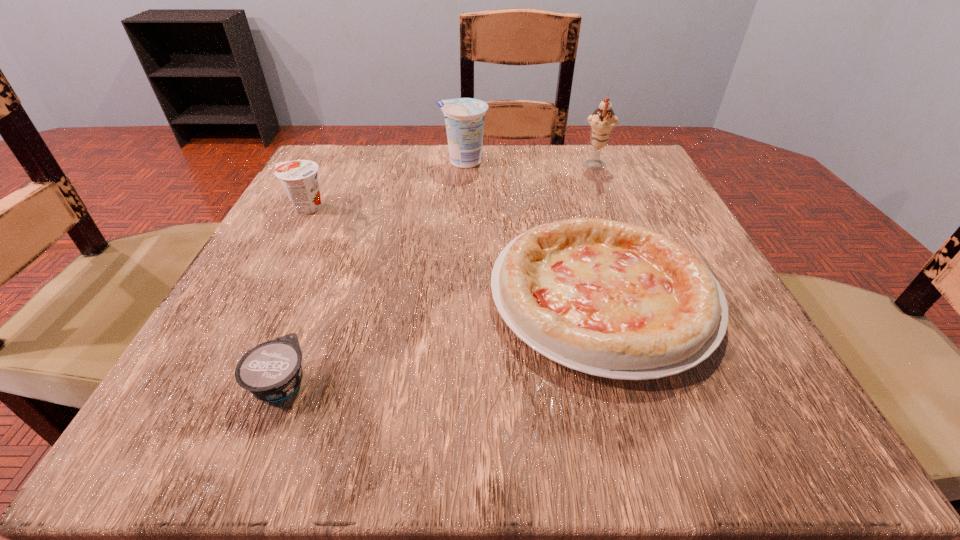
Where is `icecream`? The width and height of the screenshot is (960, 540). icecream is located at coordinates (602, 122).

This screenshot has height=540, width=960. I want to click on the tallest yogurt, so click(x=464, y=117).

You are a GUI agent. You are given a task and a screenshot of the screen. Output one action in this format:
    pyautogui.click(x=<x>, y=<y>)
    Task: Click on the second tallest object
    
    Given the screenshot: What is the action you would take?
    pyautogui.click(x=464, y=117)

Identify the location of the leftmost yogurt. (299, 178).

Locate an element on the screen. This screenshot has height=540, width=960. the third shortest object is located at coordinates (299, 178).

Identify the location of the second shortest object. The width and height of the screenshot is (960, 540). (611, 299).

Locate an element on the screen. the shortest yogurt is located at coordinates (271, 371).

I want to click on the shortest object, so click(271, 371).

The width and height of the screenshot is (960, 540). I want to click on vacant area situated on the left of the tallest object, so click(396, 167).

Locate an element on the screen. This screenshot has width=960, height=540. blank space located 0.300m on the front of the tallest yogurt is located at coordinates (457, 266).